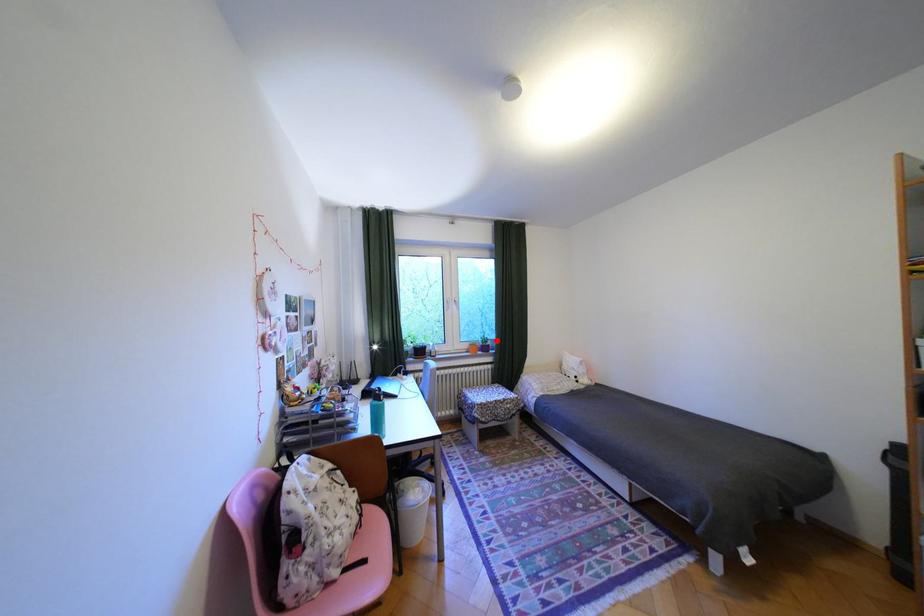
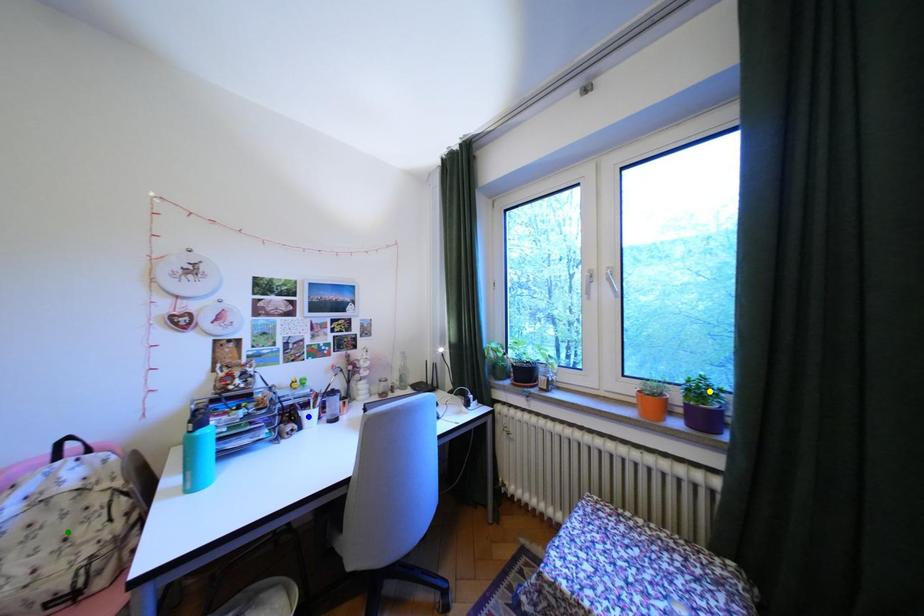
Question: I am providing you with two images of the same scene from different viewpoints. A red point is marked on the first image. You are given multiple points on the second image. Which mark in image 2 goes with the point in image 1?

Choices:
 (A) green point
 (B) blue point
 (C) yellow point

Answer: (C)